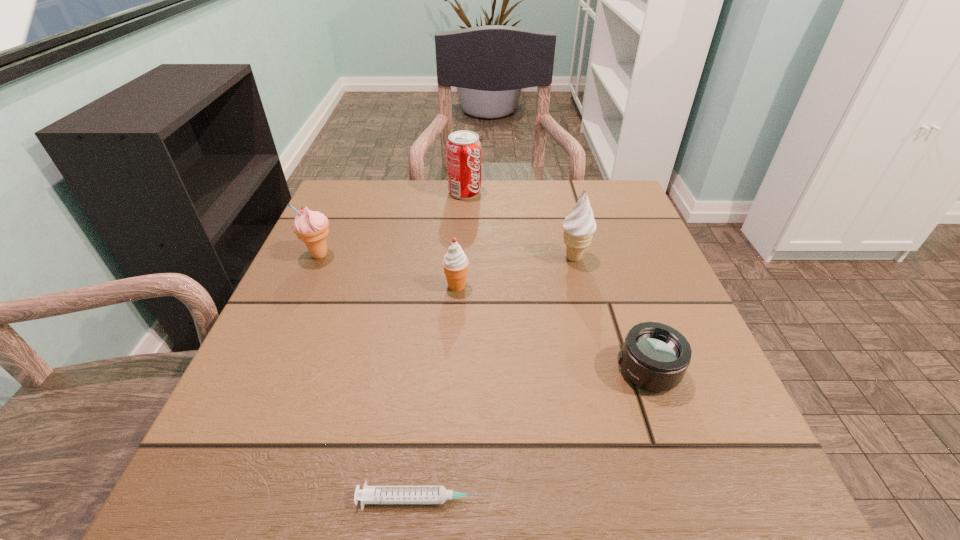
Image resolution: width=960 pixels, height=540 pixels. In order to click on object located at the near edge in this screenshot , I will do [x=370, y=494].

Find the location of a particular element. Image resolution: width=960 pixels, height=540 pixels. object at the left edge is located at coordinates (311, 227).

Identify the location of icecream situated at the right edge. The height and width of the screenshot is (540, 960). (579, 227).

Locate an element on the screen. The image size is (960, 540). telephoto lens that is at the right edge is located at coordinates (655, 357).

The image size is (960, 540). In the image, there is a desktop. Find the location of `vacant space at the far edge`. vacant space at the far edge is located at coordinates (501, 188).

Locate an element on the screen. vacant area at the left edge is located at coordinates (300, 346).

Identify the location of blank space at the right edge of the desktop. The height and width of the screenshot is (540, 960). (611, 296).

In the image, there is a desktop. Where is `vacant area at the far left corner`? Image resolution: width=960 pixels, height=540 pixels. vacant area at the far left corner is located at coordinates (397, 181).

Where is `vacant region at the far right corner of the desktop`? vacant region at the far right corner of the desktop is located at coordinates (643, 222).

The image size is (960, 540). I want to click on vacant area at the near right corner of the desktop, so click(728, 458).